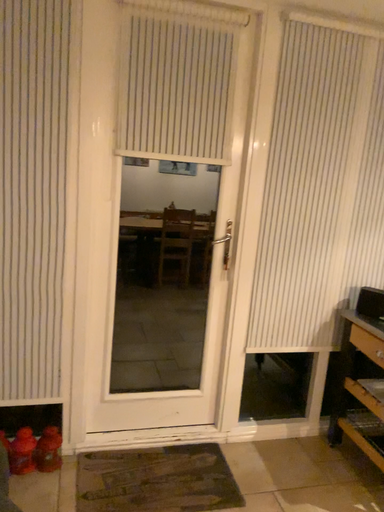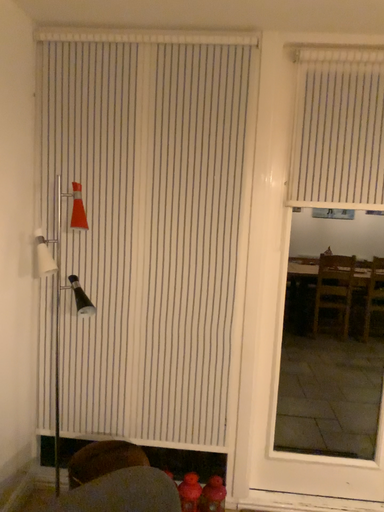
Question: How did the camera likely rotate when shooting the video?

Choices:
 (A) rotated downward
 (B) rotated upward

Answer: (B)